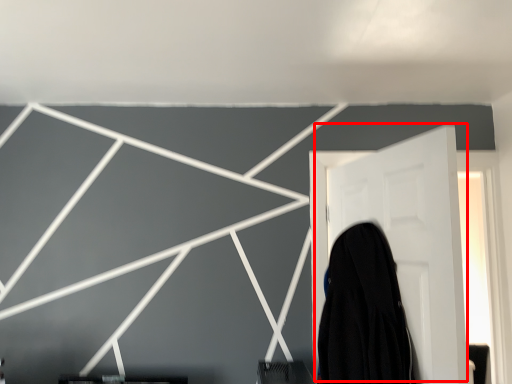
Question: Where is door (annotated by the red box) located in relation to garment in the image?

Choices:
 (A) right
 (B) left

Answer: (A)